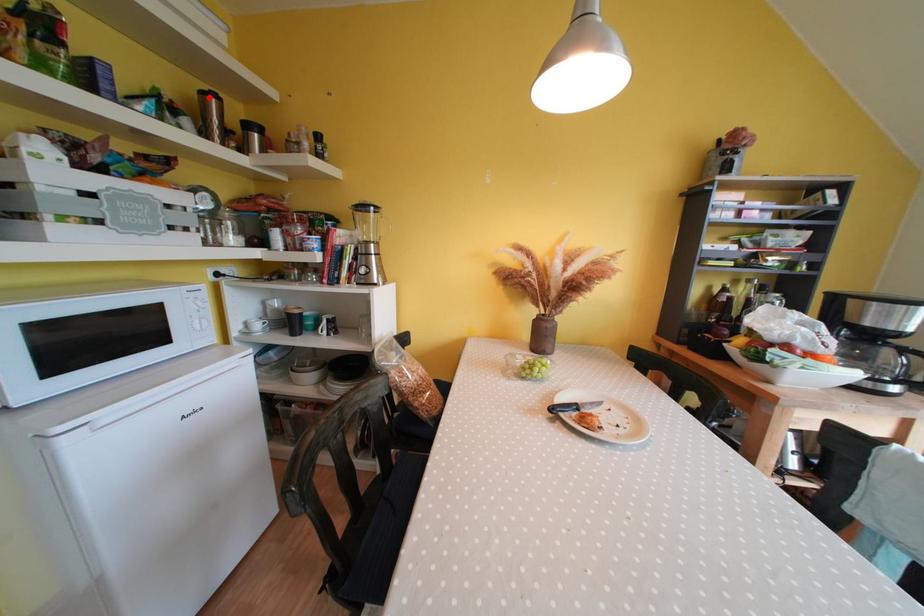
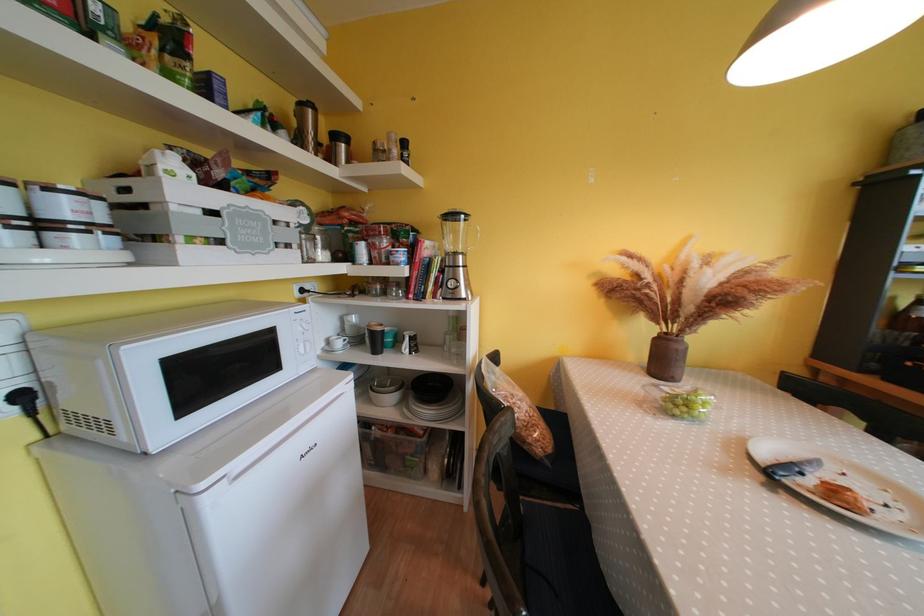
The point at the highlighted location is marked in the first image. Where is the corresponding point in the second image?

(308, 108)